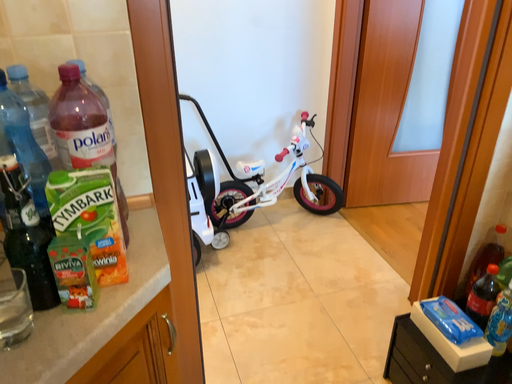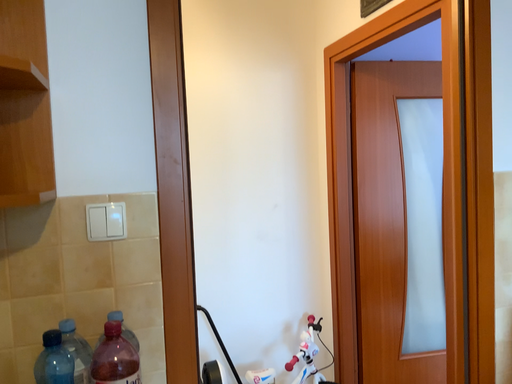
Question: Which way did the camera rotate in the video?

Choices:
 (A) rotated downward
 (B) rotated upward

Answer: (B)